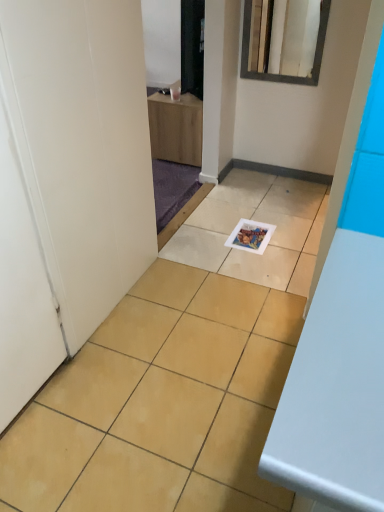
Question: Is white glossy mirror at upper center inside the boundaries of matte paper magazine at center, or outside?

Choices:
 (A) inside
 (B) outside

Answer: (B)

Question: Is white glossy mirror at upper center wider or thinner than matte paper magazine at center?

Choices:
 (A) thin
 (B) wide

Answer: (A)

Question: Estimate the real-world distances between objects in this image. Which object is closer to the white glossy mirror at upper center?

Choices:
 (A) matte paper magazine at center
 (B) white matte door at left

Answer: (A)

Question: Based on their relative distances, which object is farther from the white matte door at left?

Choices:
 (A) matte paper magazine at center
 (B) white glossy mirror at upper center

Answer: (B)